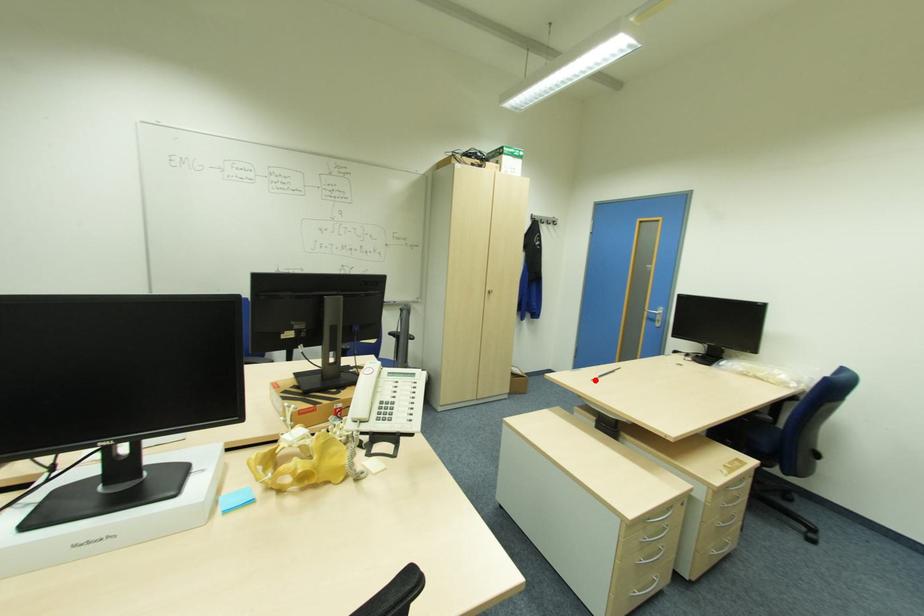
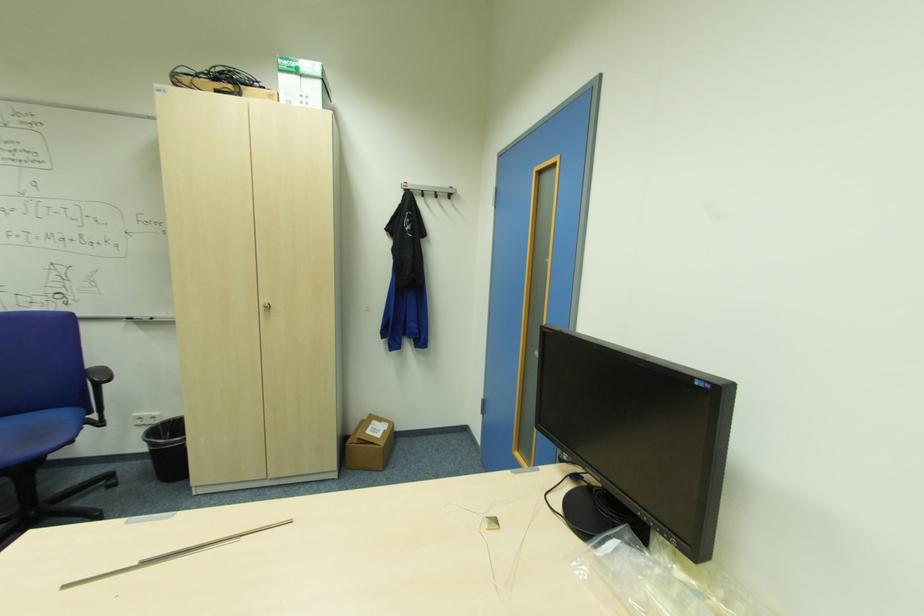
Question: A red point is marked in image1. In image2, is the corresponding 3D point closer to the camera or farther? Reply with the corresponding letter.

Choices:
 (A) The corresponding 3D point is closer.
 (B) The corresponding 3D point is farther.

Answer: (A)